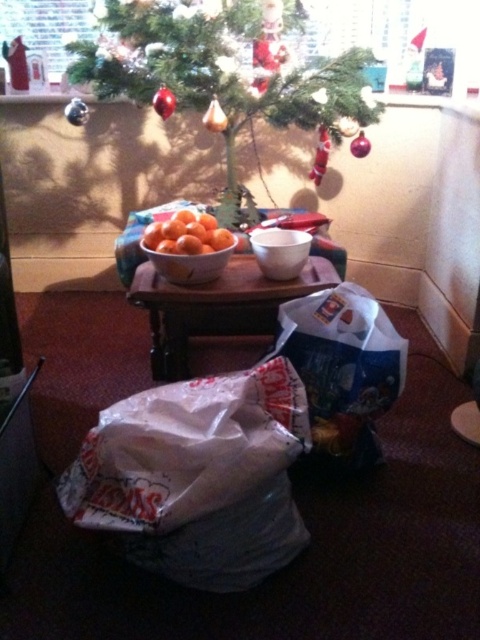
Question: Does wooden table at center appear on the right side of orange matte/orange at center?

Choices:
 (A) yes
 (B) no

Answer: (A)

Question: Can you confirm if wooden table at center is smaller than orange matte bowl at center?

Choices:
 (A) yes
 (B) no

Answer: (B)

Question: Which point is farther to the camera?

Choices:
 (A) wooden table at center
 (B) green textured christmas tree at center
 (C) orange matte bowl at center
 (D) orange matte/orange at center

Answer: (B)

Question: Which of the following is the closest to the observer?

Choices:
 (A) (167, 58)
 (B) (179, 244)
 (C) (205, 304)

Answer: (B)

Question: Can you confirm if green textured christmas tree at center is bigger than orange matte/orange at center?

Choices:
 (A) yes
 (B) no

Answer: (A)

Question: Estimate the real-world distances between objects in this image. Which object is closer to the green textured christmas tree at center?

Choices:
 (A) orange matte/orange at center
 (B) wooden table at center
 (C) orange matte bowl at center

Answer: (B)